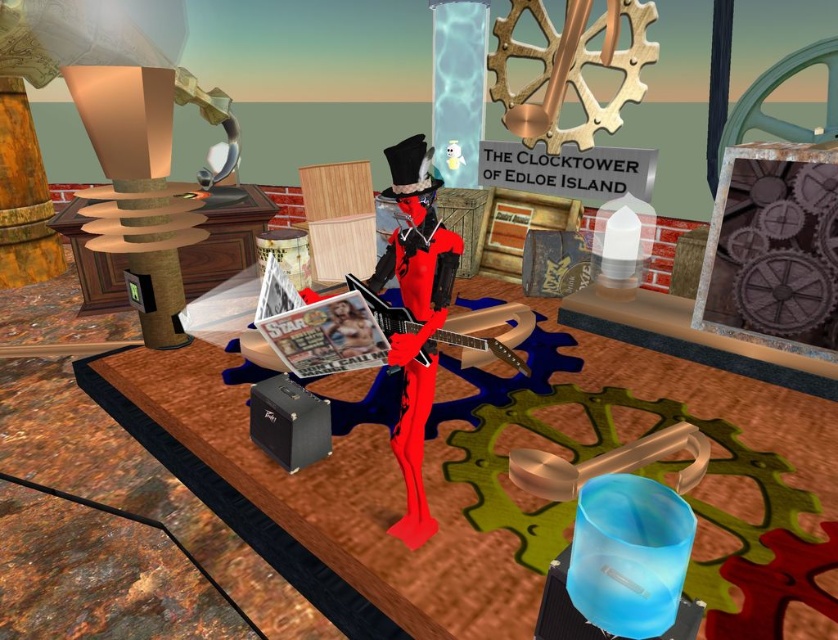
Is metallic gear at upper right above shiny red figure at center?

Yes.

Between metallic gear at upper right and shiny red figure at center, which one is positioned higher?

metallic gear at upper right is above.

Describe the element at coordinates (773, 250) in the screenshot. Image resolution: width=838 pixels, height=640 pixels. I see `metallic gear at upper right` at that location.

Locate an element on the screen. Image resolution: width=838 pixels, height=640 pixels. metallic gear at upper right is located at coordinates (773, 250).